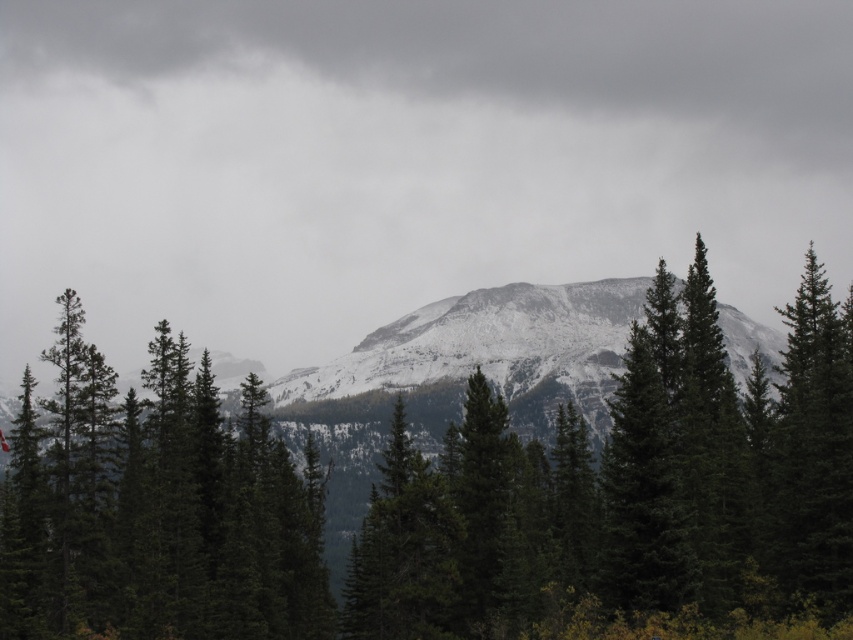
Between green matte tree at center and green matte tree at left, which one has less height?

Standing shorter between the two is green matte tree at left.

Between point (28, 598) and point (235, 630), which one is positioned behind?

The point (235, 630) is more distant.

Identify the location of green matte tree at center. The image size is (853, 640). (439, 497).